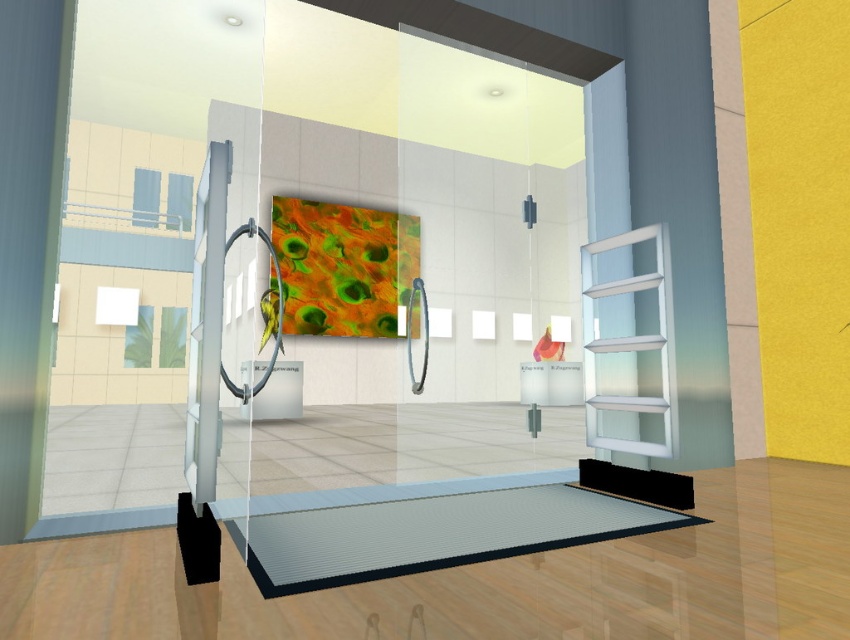
Question: Where is metallic gray mat at lower center located in relation to black rubber yoga mat at lower right in the image?

Choices:
 (A) left
 (B) right

Answer: (A)

Question: Which object is farther from the camera taking this photo?

Choices:
 (A) metallic gray mat at lower center
 (B) transparent frosted glass at right
 (C) black rubber yoga mat at lower right

Answer: (B)

Question: Which point is closer to the camera taking this photo?

Choices:
 (A) click(326, 525)
 (B) click(659, 470)
 (C) click(626, 232)

Answer: (A)

Question: Can you confirm if metallic gray mat at lower center is bigger than transparent frosted glass at right?

Choices:
 (A) no
 (B) yes

Answer: (B)

Question: Does transparent frosted glass at right have a larger size compared to black rubber yoga mat at lower right?

Choices:
 (A) no
 (B) yes

Answer: (B)

Question: Estimate the real-world distances between objects in this image. Which object is closer to the transparent frosted glass at right?

Choices:
 (A) black rubber yoga mat at lower right
 (B) metallic gray mat at lower center

Answer: (A)